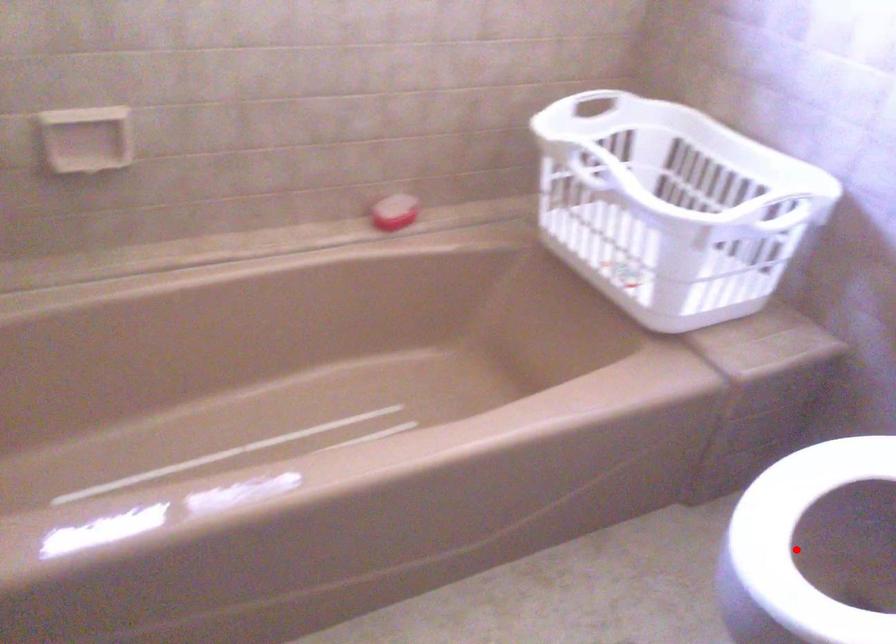
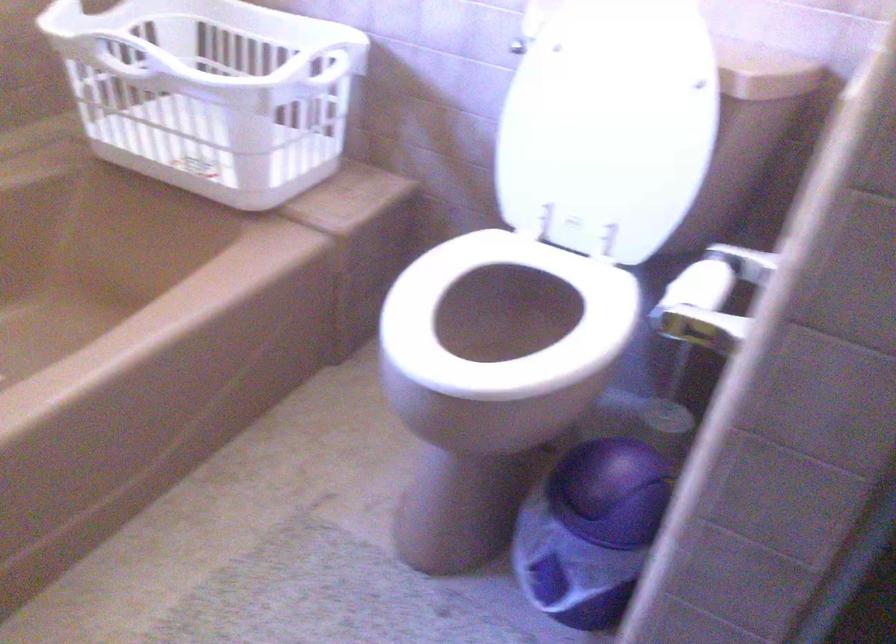
Question: I am providing you with two images of the same scene from different viewpoints. A red point is marked on the first image. At the location where the point appears in image 1, is it still visible in image 2?

Choices:
 (A) Yes
 (B) No

Answer: (B)